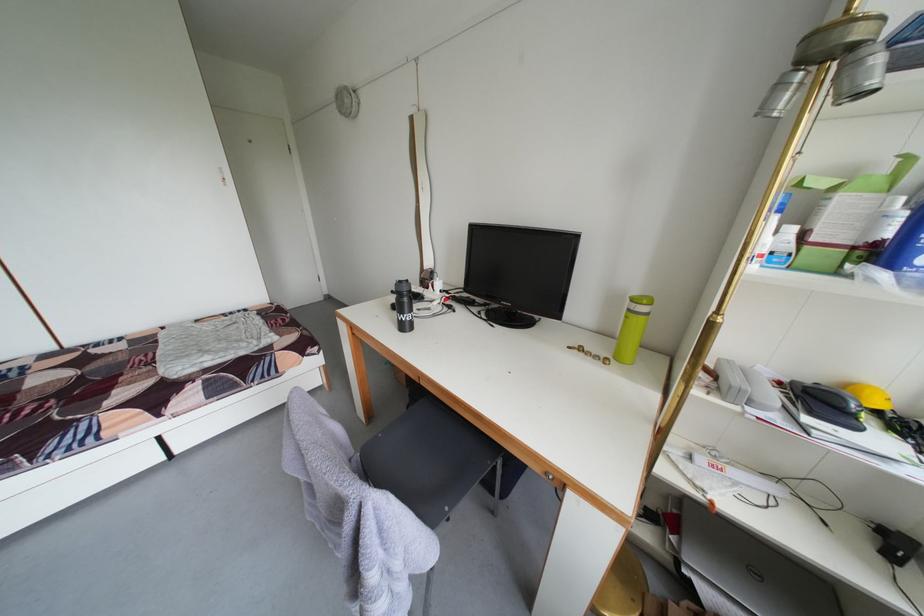
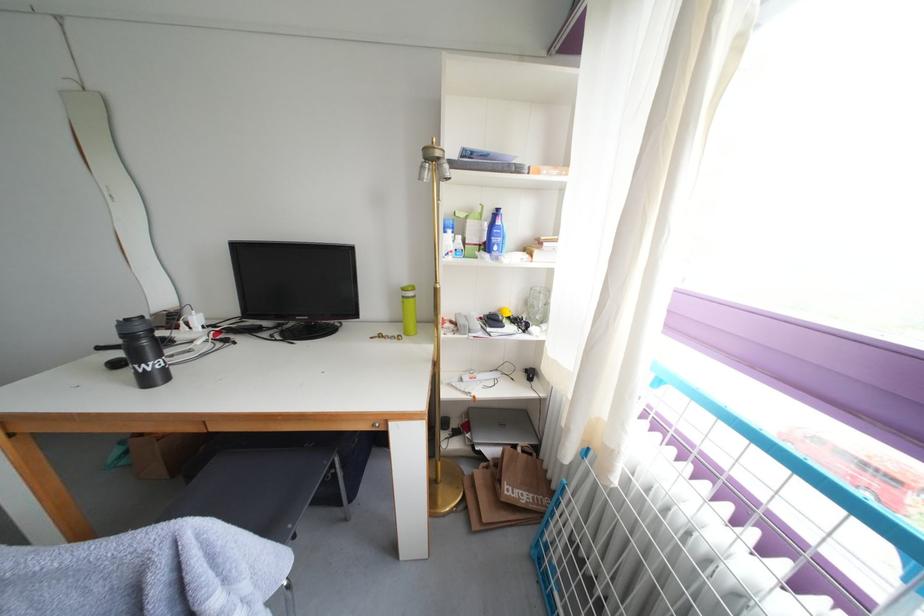
The point at [684,544] is marked in the first image. Where is the corresponding point in the second image?

(478, 440)